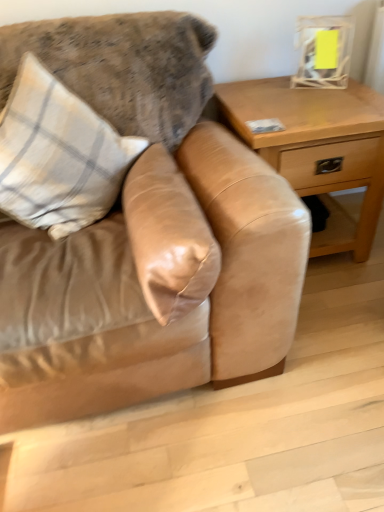
Question: Should I look upward or downward to see plaid fabric pillow at upper left, the first pillow viewed from the left?

Choices:
 (A) up
 (B) down

Answer: (A)

Question: Considering the relative sizes of plaid fabric pillow at upper left, positioned as the 2th pillow in right-to-left order, and light brown wood table at right in the image provided, is plaid fabric pillow at upper left, positioned as the 2th pillow in right-to-left order, thinner than light brown wood table at right?

Choices:
 (A) yes
 (B) no

Answer: (A)

Question: Can you confirm if plaid fabric pillow at upper left, the first pillow viewed from the left, is bigger than light brown wood table at right?

Choices:
 (A) yes
 (B) no

Answer: (B)

Question: Is plaid fabric pillow at upper left, the first pillow viewed from the left, wider than light brown wood table at right?

Choices:
 (A) no
 (B) yes

Answer: (A)

Question: Does plaid fabric pillow at upper left, positioned as the 2th pillow in right-to-left order, have a lesser height compared to light brown wood table at right?

Choices:
 (A) yes
 (B) no

Answer: (A)

Question: Is light brown wood table at right located within plaid fabric pillow at upper left, positioned as the 2th pillow in right-to-left order?

Choices:
 (A) no
 (B) yes

Answer: (A)

Question: From a real-world perspective, is plaid fabric pillow at upper left, positioned as the 2th pillow in right-to-left order, under light brown wood table at right?

Choices:
 (A) yes
 (B) no

Answer: (B)

Question: Is suede couch at center far away from suede pillow at center, which is the 2th pillow from left to right?

Choices:
 (A) yes
 (B) no

Answer: (B)

Question: Is suede couch at center wider than suede pillow at center, which is the 2th pillow from left to right?

Choices:
 (A) no
 (B) yes

Answer: (B)

Question: Can you confirm if suede couch at center is positioned to the right of suede pillow at center, which is the 2th pillow from left to right?

Choices:
 (A) no
 (B) yes

Answer: (A)

Question: Considering the relative sizes of suede couch at center and suede pillow at center, which is the 2th pillow from left to right, in the image provided, is suede couch at center thinner than suede pillow at center, which is the 2th pillow from left to right,?

Choices:
 (A) no
 (B) yes

Answer: (A)

Question: Is the depth of suede couch at center greater than that of suede pillow at center, which ranks as the 1th pillow in right-to-left order?

Choices:
 (A) yes
 (B) no

Answer: (B)

Question: Is suede couch at center touching suede pillow at center, which is the 2th pillow from left to right?

Choices:
 (A) yes
 (B) no

Answer: (B)

Question: Is suede couch at center thinner than light brown wood table at right?

Choices:
 (A) yes
 (B) no

Answer: (B)